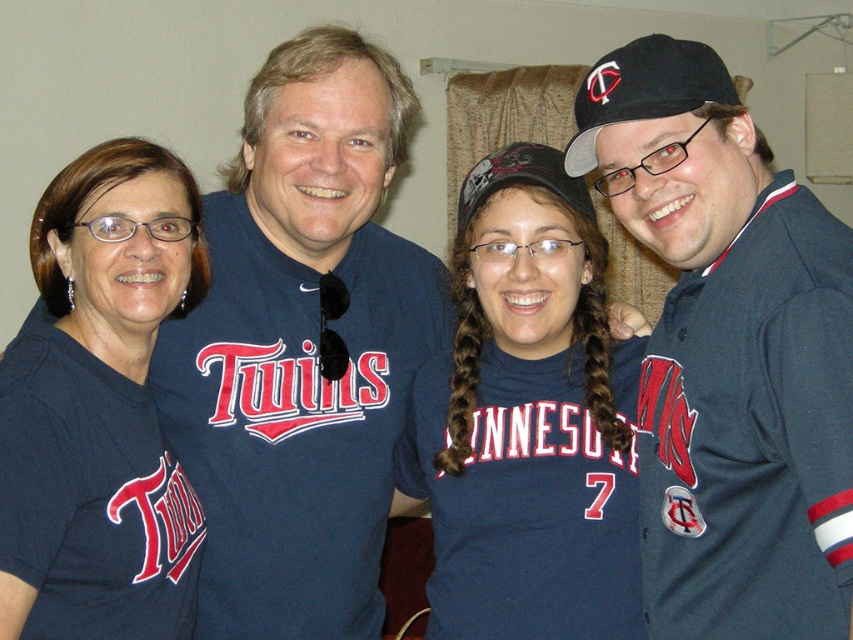
Question: Which point is farther to the camera?

Choices:
 (A) (689, 259)
 (B) (569, 161)
 (C) (412, 269)
 (D) (527, 572)

Answer: (C)

Question: Where is navy blue jersey at center located in relation to black fabric baseball cap at right in the image?

Choices:
 (A) left
 (B) right

Answer: (A)

Question: Which object is the closest to the black fabric baseball cap at right?

Choices:
 (A) blue matte jersey at center
 (B) blue jersey at right
 (C) navy blue jersey at center

Answer: (B)

Question: In this image, where is matte blue shirt at left located relative to black fabric baseball cap at right?

Choices:
 (A) above
 (B) below

Answer: (B)

Question: Which point is farther to the camera?

Choices:
 (A) matte blue shirt at left
 (B) navy blue jersey at center
 (C) blue matte jersey at center
 (D) black fabric baseball cap at right

Answer: (B)

Question: Is navy blue jersey at center bigger than matte blue shirt at left?

Choices:
 (A) yes
 (B) no

Answer: (A)